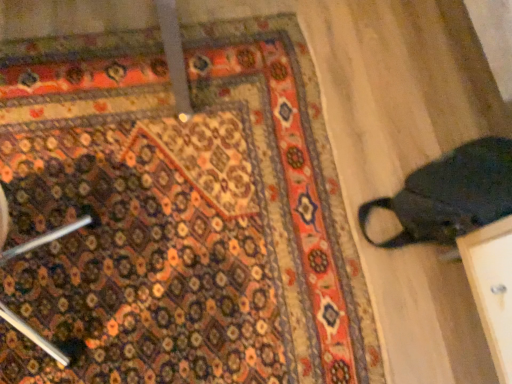
Describe the element at coordinates (179, 213) in the screenshot. I see `carpeted mat at lower left` at that location.

Locate an element on the screen. carpeted mat at lower left is located at coordinates (179, 213).

Describe the element at coordinates (450, 195) in the screenshot. The width and height of the screenshot is (512, 384). I see `dark fabric bag at right` at that location.

In order to click on dark fabric bag at right in this screenshot , I will do `click(450, 195)`.

Identify the location of carpeted mat at lower left. This screenshot has width=512, height=384. point(179,213).

Between carpeted mat at lower left and dark fabric bag at right, which one appears on the left side from the viewer's perspective?

carpeted mat at lower left.

Which object is closer to the camera taking this photo, carpeted mat at lower left or dark fabric bag at right?

dark fabric bag at right is in front.

Does point (108, 234) lie behind point (485, 178)?

No, it is in front of (485, 178).

From the image's perspective, does carpeted mat at lower left appear higher than dark fabric bag at right?

Incorrect, from the image's perspective, carpeted mat at lower left is lower than dark fabric bag at right.

From a real-world perspective, between carpeted mat at lower left and dark fabric bag at right, who is vertically lower?

carpeted mat at lower left is physically lower.

Looking at their sizes, would you say carpeted mat at lower left is wider or thinner than dark fabric bag at right?

Considering their sizes, carpeted mat at lower left looks broader than dark fabric bag at right.

Between carpeted mat at lower left and dark fabric bag at right, which one has more height?

Standing taller between the two is dark fabric bag at right.

Considering the sizes of carpeted mat at lower left and dark fabric bag at right in the image, is carpeted mat at lower left bigger or smaller than dark fabric bag at right?

Considering their sizes, carpeted mat at lower left takes up less space than dark fabric bag at right.

Do you think carpeted mat at lower left is within dark fabric bag at right, or outside of it?

carpeted mat at lower left is not enclosed by dark fabric bag at right.

Is carpeted mat at lower left not near dark fabric bag at right?

carpeted mat at lower left is actually quite close to dark fabric bag at right.

Is carpeted mat at lower left aimed at dark fabric bag at right?

No.

Image resolution: width=512 pixels, height=384 pixels. Find the location of `footwear lying above the carpeted mat at lower left (from the image's perspective)`. footwear lying above the carpeted mat at lower left (from the image's perspective) is located at coordinates (450, 195).

Is dark fabric bag at right to the left or to the right of carpeted mat at lower left in the image?

In the image, dark fabric bag at right appears on the right side of carpeted mat at lower left.

Based on the photo, is dark fabric bag at right behind carpeted mat at lower left?

That is False.

Does point (495, 205) come in front of point (30, 317)?

Yes.

From the image's perspective, between dark fabric bag at right and carpeted mat at lower left, who is located below?

carpeted mat at lower left, from the image's perspective.

From a real-world perspective, between dark fabric bag at right and carpeted mat at lower left, who is vertically higher?

dark fabric bag at right, from a real-world perspective.

Considering the sizes of objects dark fabric bag at right and carpeted mat at lower left in the image provided, who is thinner, dark fabric bag at right or carpeted mat at lower left?

With smaller width is dark fabric bag at right.

Considering the sizes of objects dark fabric bag at right and carpeted mat at lower left in the image provided, who is taller, dark fabric bag at right or carpeted mat at lower left?

Standing taller between the two is dark fabric bag at right.

Between dark fabric bag at right and carpeted mat at lower left, which one has larger size?

dark fabric bag at right.

Is carpeted mat at lower left completely or partially inside dark fabric bag at right?

Actually, carpeted mat at lower left is outside dark fabric bag at right.

Is dark fabric bag at right next to carpeted mat at lower left and touching it?

No, dark fabric bag at right is not in contact with carpeted mat at lower left.

Is dark fabric bag at right turned away from carpeted mat at lower left?

No, dark fabric bag at right is not facing the opposite direction of carpeted mat at lower left.

Find the location of a particular element. footwear in front of the carpeted mat at lower left is located at coordinates pos(450,195).

In order to click on footwear above the carpeted mat at lower left (from the image's perspective) in this screenshot , I will do `click(450, 195)`.

Where is `mat that appears on the left of dark fabric bag at right`? mat that appears on the left of dark fabric bag at right is located at coordinates (179, 213).